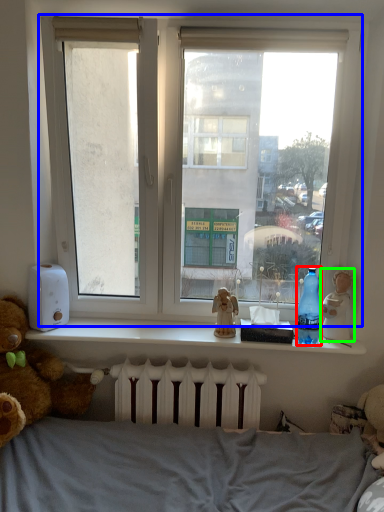
Question: Which object is the closest to the bottle (highlighted by a red box)? Choose among these: window (highlighted by a blue box) or figurine (highlighted by a green box).

Choices:
 (A) window
 (B) figurine

Answer: (B)